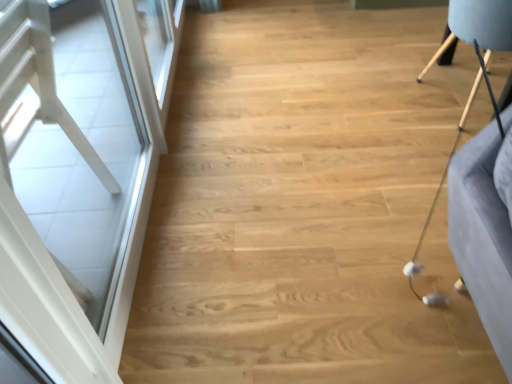
Question: Is white glossy screen door at left placed right next to light brown wooden chair at upper right?

Choices:
 (A) no
 (B) yes

Answer: (A)

Question: From a real-world perspective, is white glossy screen door at left below light brown wooden chair at upper right?

Choices:
 (A) no
 (B) yes

Answer: (A)

Question: Is white glossy screen door at left positioned far away from light brown wooden chair at upper right?

Choices:
 (A) yes
 (B) no

Answer: (A)

Question: From the image's perspective, is white glossy screen door at left over light brown wooden chair at upper right?

Choices:
 (A) yes
 (B) no

Answer: (B)

Question: Is white glossy screen door at left to the right of light brown wooden chair at upper right from the viewer's perspective?

Choices:
 (A) yes
 (B) no

Answer: (B)

Question: Is white glossy screen door at left thinner than light brown wooden chair at upper right?

Choices:
 (A) no
 (B) yes

Answer: (B)

Question: Does light brown wooden chair at upper right have a lesser height compared to white glossy screen door at left?

Choices:
 (A) no
 (B) yes

Answer: (B)

Question: Is light brown wooden chair at upper right not within white glossy screen door at left?

Choices:
 (A) no
 (B) yes

Answer: (B)

Question: Is white glossy screen door at left surrounded by light brown wooden chair at upper right?

Choices:
 (A) no
 (B) yes

Answer: (A)

Question: Could you tell me if light brown wooden chair at upper right is turned towards white glossy screen door at left?

Choices:
 (A) yes
 (B) no

Answer: (B)

Question: Does light brown wooden chair at upper right have a smaller size compared to white glossy screen door at left?

Choices:
 (A) yes
 (B) no

Answer: (B)

Question: Does light brown wooden chair at upper right have a greater height compared to white glossy screen door at left?

Choices:
 (A) yes
 (B) no

Answer: (B)

Question: Considering the positions of white glossy screen door at left and light brown wooden chair at upper right in the image, is white glossy screen door at left wider or thinner than light brown wooden chair at upper right?

Choices:
 (A) thin
 (B) wide

Answer: (A)